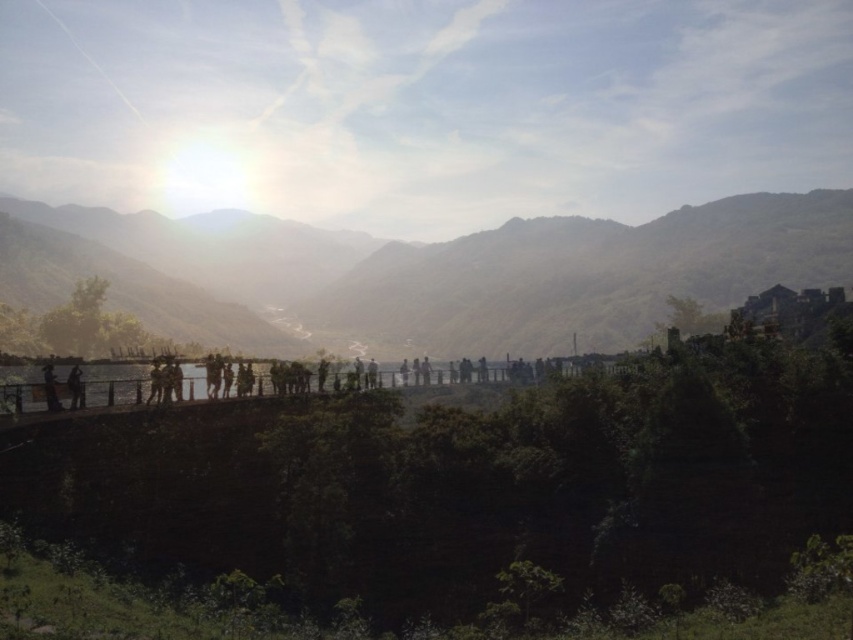
Can you confirm if green matte mountain at center is positioned to the right of matte black person at lower left?

Indeed, green matte mountain at center is positioned on the right side of matte black person at lower left.

Does point (425, 336) come closer to viewer compared to point (56, 401)?

That is False.

Does point (90, 234) come in front of point (45, 380)?

No, it is not.

Image resolution: width=853 pixels, height=640 pixels. I want to click on green matte mountain at center, so click(x=434, y=273).

Is green matte mountain at center shorter than silhouette figure at left?

No.

Is green matte mountain at center bigger than silhouette figure at left?

Correct, green matte mountain at center is larger in size than silhouette figure at left.

Between point (648, 291) and point (78, 384), which one is positioned behind?

Positioned behind is point (648, 291).

Where is `green matte mountain at center`? The height and width of the screenshot is (640, 853). green matte mountain at center is located at coordinates (434, 273).

Does matte black person at lower left have a greater width compared to silhouette figure at left?

Yes.

Who is positioned more to the right, matte black person at lower left or silhouette figure at left?

silhouette figure at left is more to the right.

Between point (55, 403) and point (74, 381), which one is positioned in front?

Positioned in front is point (55, 403).

Find the location of a particular element. The width and height of the screenshot is (853, 640). matte black person at lower left is located at coordinates (50, 388).